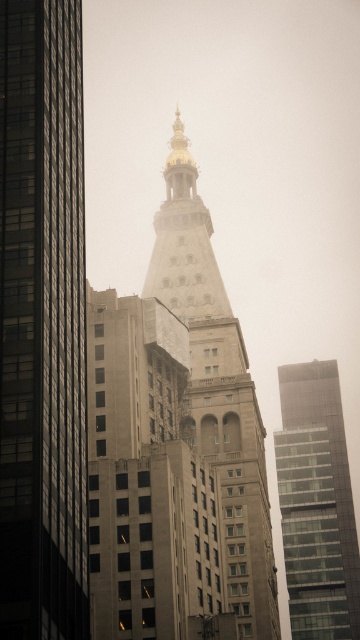
You are a photographer standing on the street level of the city. You want to take a photo of the golden stone tower at center without the glassy reflective skyscraper at right appearing in the background. Is this possible based on their positions?

The golden stone tower at center is in front of the glassy reflective skyscraper at right, so it is possible to take a photo of the golden stone tower at center without the glassy reflective skyscraper at right in the background by positioning yourself so that the tower blocks the view of the skyscraper.

You are a tourist in New York City and want to take a photo of the smooth glass skyscraper at center and the golden stone tower at center. Which one should you stand closer to in order to capture both in a single frame?

You should stand closer to the smooth glass skyscraper at center because it is positioned on the left side of the golden stone tower at center, allowing both to be captured in the frame when moving towards the leftmost object.